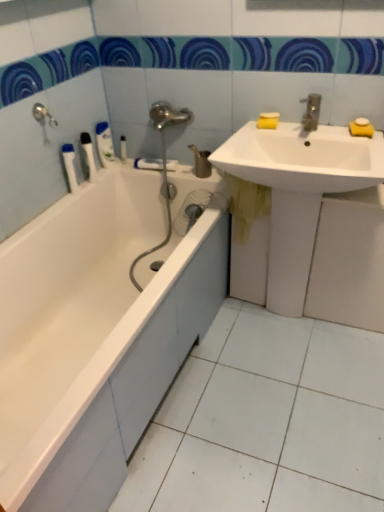
Locate an element on the screen. vacant space that is in between yellow matte soap at upper right, the 3th soap positioned from the right, and yellow sponge at upper right, which is the 2th soap from left to right is located at coordinates (318, 129).